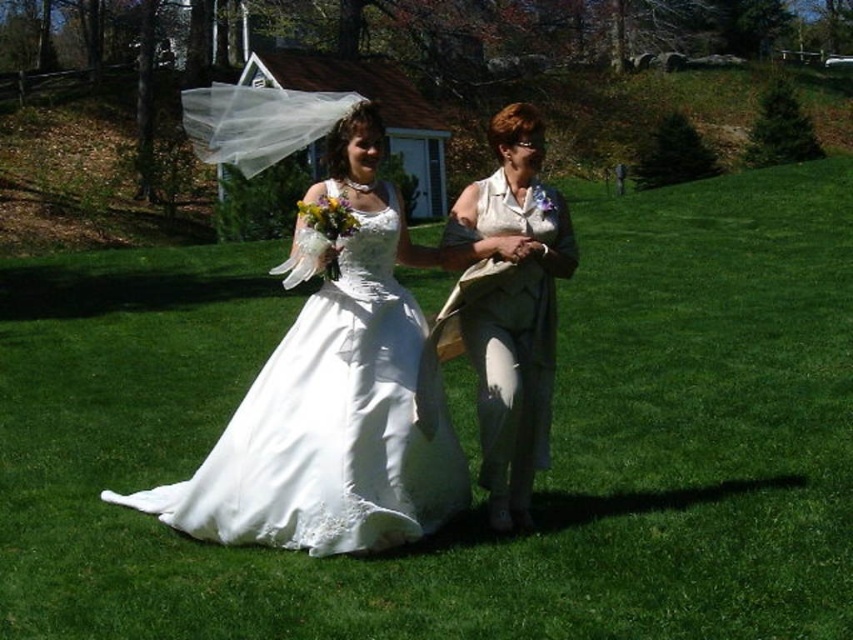
Question: Which point is farther to the camera?

Choices:
 (A) white satin dress at center
 (B) matte white blouse at center

Answer: (B)

Question: Does white satin dress at center lie in front of matte white blouse at center?

Choices:
 (A) yes
 (B) no

Answer: (A)

Question: Is white satin dress at center to the left of matte white blouse at center from the viewer's perspective?

Choices:
 (A) no
 (B) yes

Answer: (B)

Question: Does white satin dress at center lie behind matte white blouse at center?

Choices:
 (A) yes
 (B) no

Answer: (B)